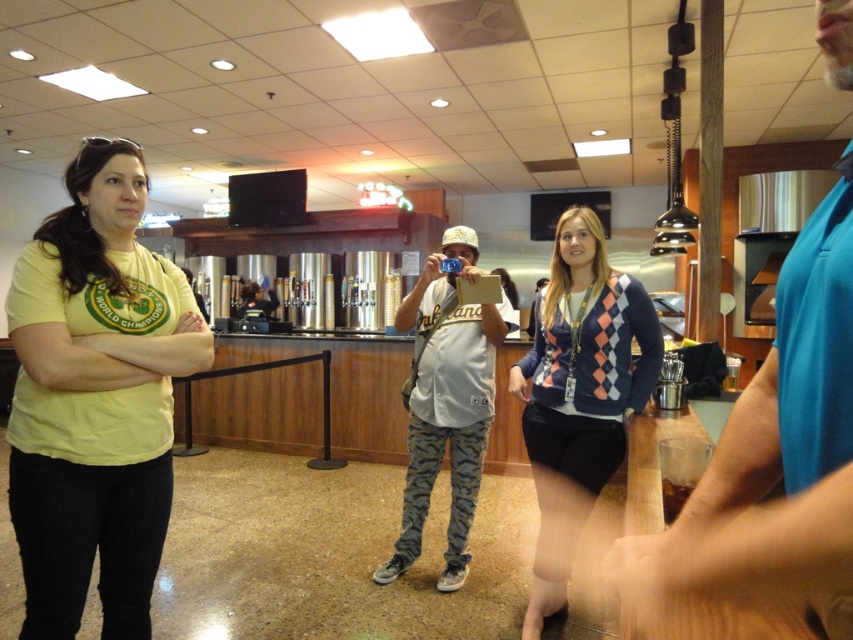
Question: Which point appears closest to the camera in this image?

Choices:
 (A) (123, 428)
 (B) (624, 304)

Answer: (A)

Question: Is yellow matte t-shirt at left thinner than argyle sweater at center?

Choices:
 (A) no
 (B) yes

Answer: (B)

Question: Which point is farther to the camera?

Choices:
 (A) blue fabric shirt at center
 (B) argyle sweater at center

Answer: (B)

Question: Does argyle sweater at center lie in front of white cotton shirt at center?

Choices:
 (A) yes
 (B) no

Answer: (A)

Question: Estimate the real-world distances between objects in this image. Which object is closer to the argyle sweater at center?

Choices:
 (A) blue fabric shirt at center
 (B) white cotton shirt at center

Answer: (B)

Question: Observing the image, what is the correct spatial positioning of blue fabric shirt at center in reference to argyle sweater at center?

Choices:
 (A) below
 (B) above

Answer: (B)